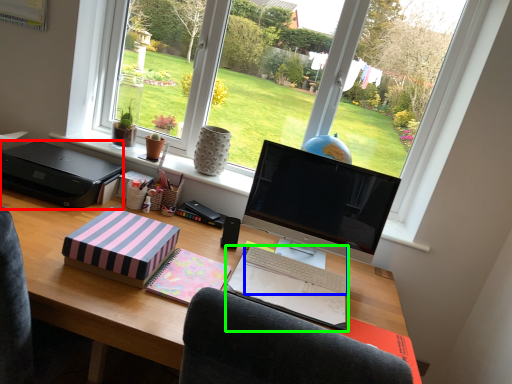
Question: Based on their relative distances, which object is nearer to printer (highlighted by a red box)? Choose from computer keyboard (highlighted by a blue box) and notebook (highlighted by a green box).

Choices:
 (A) computer keyboard
 (B) notebook

Answer: (B)